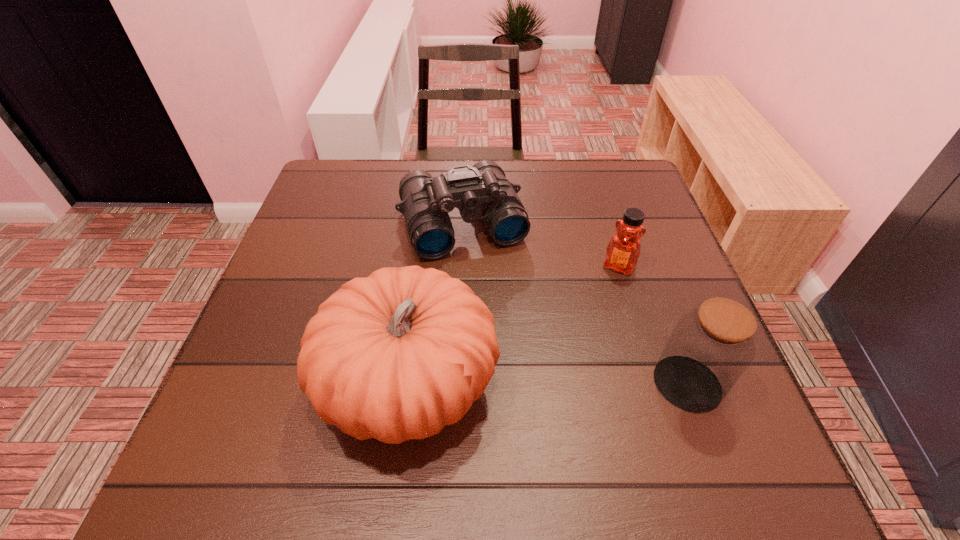
Image resolution: width=960 pixels, height=540 pixels. I want to click on vacant space located through the lenses of the binoculars, so click(523, 378).

Locate an element on the screen. This screenshot has height=540, width=960. vacant region located through the lenses of the binoculars is located at coordinates click(535, 408).

You are a GUI agent. You are given a task and a screenshot of the screen. Output one action in this format:
    pyautogui.click(x=<x>, y=<y>)
    Task: Click on the object present at the far edge
    The width and height of the screenshot is (960, 540).
    Given the screenshot: What is the action you would take?
    pyautogui.click(x=482, y=190)

At what (x,y) coordinates should I click in order to perform the action: click on pumpkin present at the near edge. Please return your answer as a coordinate pair (x, y). This screenshot has height=540, width=960. Looking at the image, I should click on (397, 355).

The image size is (960, 540). In order to click on jar situated at the near edge in this screenshot , I will do `click(710, 347)`.

The width and height of the screenshot is (960, 540). I want to click on jar that is at the right edge, so click(x=710, y=347).

You are a GUI agent. You are given a task and a screenshot of the screen. Output one action in this format:
    pyautogui.click(x=<x>, y=<y>)
    Task: Click on the honey at the right edge
    This screenshot has height=540, width=960.
    Given the screenshot: What is the action you would take?
    pyautogui.click(x=623, y=250)

Locate an element on the screen. The width and height of the screenshot is (960, 540). object at the near right corner is located at coordinates pos(710,347).

The height and width of the screenshot is (540, 960). In the image, there is a desktop. Identify the location of vacant space at the far edge. (377, 194).

This screenshot has width=960, height=540. Find the location of `blank area at the left edge`. blank area at the left edge is located at coordinates (262, 309).